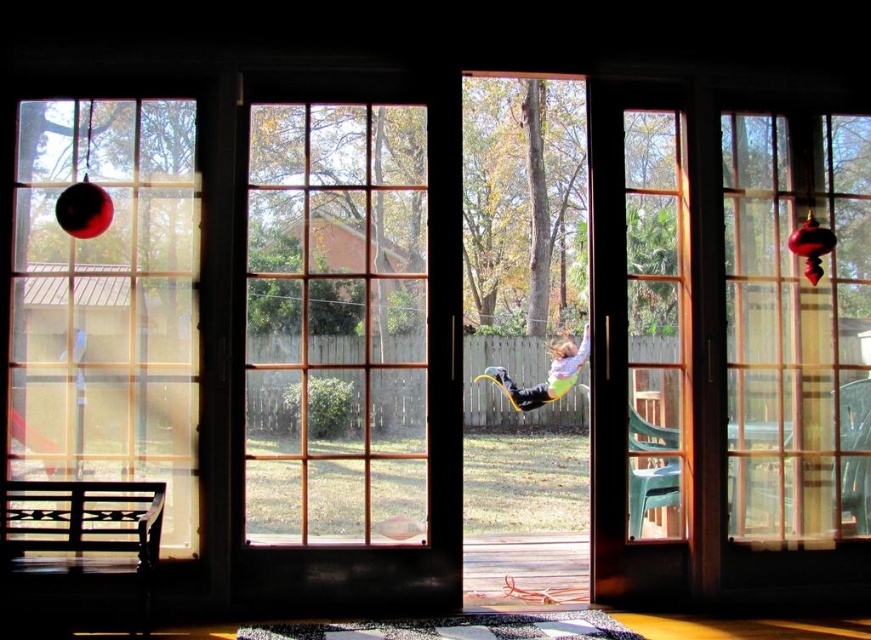
Question: Is multicolored plastic swing at center closer to the viewer compared to shiny red ornament at left?

Choices:
 (A) yes
 (B) no

Answer: (B)

Question: Does multicolored plastic swing at center appear on the left side of shiny red ornament at left?

Choices:
 (A) no
 (B) yes

Answer: (A)

Question: Which object is farther from the camera taking this photo?

Choices:
 (A) multicolored plastic swing at center
 (B) shiny red ornament at left

Answer: (A)

Question: Which object appears farthest from the camera in this image?

Choices:
 (A) shiny red ornament at left
 (B) multicolored plastic swing at center

Answer: (B)

Question: Does multicolored plastic swing at center appear on the right side of shiny red ornament at left?

Choices:
 (A) no
 (B) yes

Answer: (B)